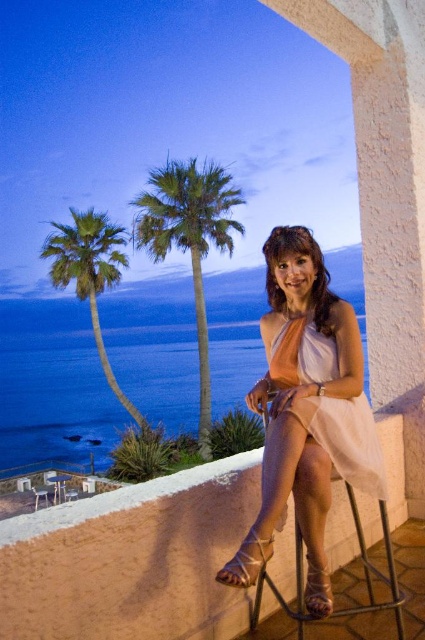
Who is positioned more to the left, metallic silver bar stool at lower right or matte brown sandal at lower center?

Positioned to the left is matte brown sandal at lower center.

Does metallic silver bar stool at lower right appear over matte brown sandal at lower center?

No.

Locate an element on the screen. The image size is (425, 640). metallic silver bar stool at lower right is located at coordinates (376, 570).

Which is more to the right, matte brown sandal at lower center or metallic silver bar stool at lower left?

matte brown sandal at lower center

Who is positioned more to the left, matte brown sandal at lower center or metallic silver bar stool at lower left?

Positioned to the left is metallic silver bar stool at lower left.

Is point (257, 541) positioned before point (53, 472)?

Yes, point (257, 541) is closer to viewer.

Find the location of a particular element. matte brown sandal at lower center is located at coordinates (246, 561).

Looking at this image, can you confirm if green leafy palm tree at center is thinner than metallic silver bar stool at lower left?

A: In fact, green leafy palm tree at center might be wider than metallic silver bar stool at lower left.

Locate an element on the screen. The width and height of the screenshot is (425, 640). green leafy palm tree at center is located at coordinates (189, 240).

The width and height of the screenshot is (425, 640). What are the coordinates of `green leafy palm tree at center` in the screenshot? It's located at (189, 240).